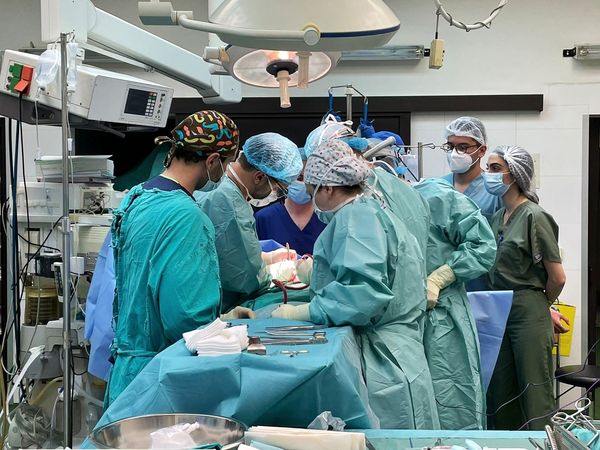
Find the location of `operation table`. operation table is located at coordinates (295, 284).